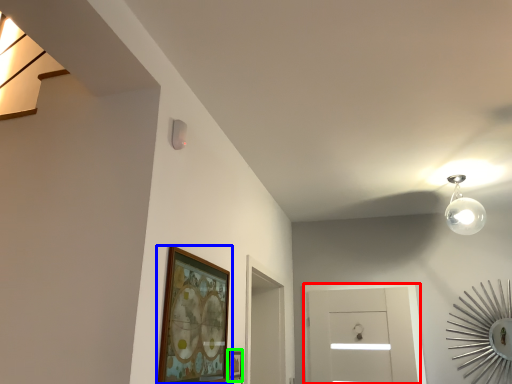
Question: Which object is the closest to the glass door (highlighted by a red box)? Choose among these: picture frame (highlighted by a blue box) or picture frame (highlighted by a green box).

Choices:
 (A) picture frame
 (B) picture frame

Answer: (B)